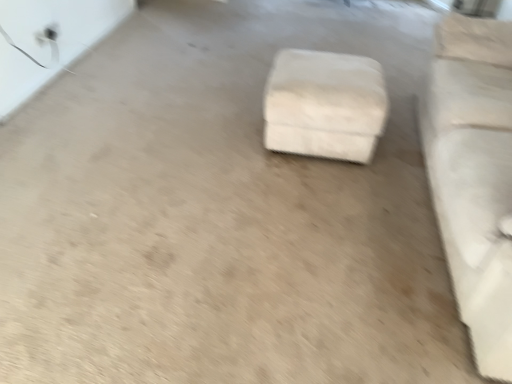
At what (x,y) coordinates should I click in order to perform the action: click on white fabric ottoman at center. Please return your answer as a coordinate pair (x, y). Image resolution: width=512 pixels, height=384 pixels. Looking at the image, I should click on (325, 105).

This screenshot has height=384, width=512. What do you see at coordinates (325, 105) in the screenshot?
I see `white fabric ottoman at center` at bounding box center [325, 105].

This screenshot has width=512, height=384. What are the coordinates of `white fabric ottoman at center` in the screenshot? It's located at (325, 105).